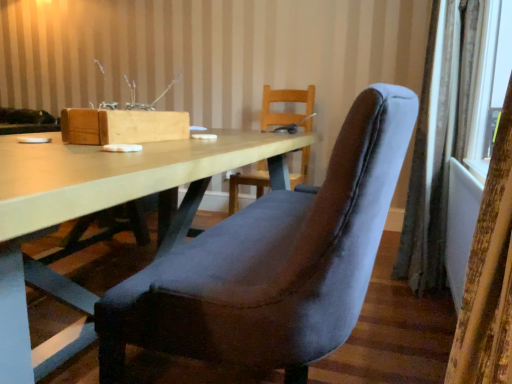
I want to click on matte wood table at center, so tap(103, 205).

Where is `velvet curtain at right, which is the second curtain in back-to-front order`? The width and height of the screenshot is (512, 384). velvet curtain at right, which is the second curtain in back-to-front order is located at coordinates (489, 276).

Locate an element on the screen. matte wood table at center is located at coordinates (103, 205).

Is velvet curtain at right, the second curtain positioned from the left, to the left or to the right of velvet blue chair at center in the image?

velvet curtain at right, the second curtain positioned from the left, is positioned on velvet blue chair at center's right side.

From a real-world perspective, is velvet curtain at right, the second curtain positioned from the left, positioned under velvet blue chair at center based on gravity?

Actually, velvet curtain at right, the second curtain positioned from the left, is physically above velvet blue chair at center in the real world.

In the scene shown: Are velvet curtain at right, the first curtain in the back-to-front sequence, and velvet blue chair at center far apart?

That's right, there is a large distance between velvet curtain at right, the first curtain in the back-to-front sequence, and velvet blue chair at center.

Consider the image. Is velvet curtain at right, the first curtain in the back-to-front sequence, looking in the opposite direction of velvet blue chair at center?

No.

Is velvet blue chair at center taller or shorter than velvet curtain at right, the 2th curtain from the front?

In the image, velvet blue chair at center appears to be shorter than velvet curtain at right, the 2th curtain from the front.

Is velvet blue chair at center not inside velvet curtain at right, the second curtain positioned from the left?

Yes, velvet blue chair at center is outside of velvet curtain at right, the second curtain positioned from the left.

Is velvet blue chair at center positioned with its back to velvet curtain at right, the second curtain positioned from the left?

No, velvet blue chair at center is not facing away from velvet curtain at right, the second curtain positioned from the left.

Does velvet blue chair at center touch velvet curtain at right, the 2th curtain from the front?

No, velvet blue chair at center is not beside velvet curtain at right, the 2th curtain from the front.

Does matte wood table at center contain velvet blue chair at center?

No.

From the image's perspective, between matte wood table at center and velvet blue chair at center, who is located below?

matte wood table at center is shown below in the image.

Which object is further away from the camera taking this photo, matte wood table at center or velvet blue chair at center?

velvet blue chair at center is further away from the camera.

Does matte wood table at center appear on the left side of velvet curtain at right, the 2th curtain from the front?

Yes.

How many degrees apart are the facing directions of matte wood table at center and velvet curtain at right, the first curtain in the back-to-front sequence?

The angular difference between matte wood table at center and velvet curtain at right, the first curtain in the back-to-front sequence, is 7.82 degrees.

Does matte wood table at center lie in front of velvet curtain at right, the second curtain positioned from the left?

Yes, matte wood table at center is closer to the viewer.

Can you confirm if matte wood table at center is wider than velvet curtain at right, the second curtain positioned from the left?

Indeed, matte wood table at center has a greater width compared to velvet curtain at right, the second curtain positioned from the left.

In terms of size, does velvet blue chair at center appear bigger or smaller than velvet curtain at right, acting as the first curtain starting from the left?

Considering their sizes, velvet blue chair at center takes up more space than velvet curtain at right, acting as the first curtain starting from the left.

Does velvet blue chair at center have a greater height compared to velvet curtain at right, acting as the first curtain starting from the left?

Yes, velvet blue chair at center is taller than velvet curtain at right, acting as the first curtain starting from the left.

Can you see velvet blue chair at center touching velvet curtain at right, acting as the first curtain starting from the left?

No, velvet blue chair at center is not next to velvet curtain at right, acting as the first curtain starting from the left.

You are a GUI agent. You are given a task and a screenshot of the screen. Output one action in this format:
    pyautogui.click(x=<x>, y=<y>)
    Task: Click on the 1st curtain to the right of the velvet blue chair at center, starting your count from the anchor
    Image resolution: width=512 pixels, height=384 pixels.
    Given the screenshot: What is the action you would take?
    pyautogui.click(x=489, y=276)

From the image's perspective, is velvet curtain at right, the first curtain in the back-to-front sequence, beneath velvet curtain at right, acting as the first curtain starting from the front?

No.

Based on the photo, from a real-world perspective, is velvet curtain at right, the first curtain positioned from the right, positioned over velvet curtain at right, which is the second curtain in back-to-front order, based on gravity?

Yes, from a real-world perspective, velvet curtain at right, the first curtain positioned from the right, is on top of velvet curtain at right, which is the second curtain in back-to-front order.

Does point (420, 131) appear closer or farther from the camera than point (472, 351)?

Point (420, 131) appears to be farther away from the viewer than point (472, 351).

From the image's perspective, does matte wood table at center appear higher than velvet curtain at right, acting as the first curtain starting from the left?

Incorrect, from the image's perspective, matte wood table at center is lower than velvet curtain at right, acting as the first curtain starting from the left.

Is matte wood table at center positioned with its back to velvet curtain at right, arranged as the 2th curtain when viewed from the right?

Yes, matte wood table at center is positioned with its back facing velvet curtain at right, arranged as the 2th curtain when viewed from the right.

From a real-world perspective, is matte wood table at center physically above velvet curtain at right, which is the second curtain in back-to-front order?

No.

Does point (7, 206) lie in front of point (511, 185)?

That is True.

You are a GUI agent. You are given a task and a screenshot of the screen. Output one action in this format:
    pyautogui.click(x=<x>, y=<y>)
    Task: Click on the chair lying in front of the velvet curtain at right, the 2th curtain from the front
    The width and height of the screenshot is (512, 384).
    Given the screenshot: What is the action you would take?
    pyautogui.click(x=272, y=262)

From the image's perspective, count 2nd curtains upward from the velvet blue chair at center and point to it. Please provide its 2D coordinates.

[(431, 156)]

Considering their positions, is velvet curtain at right, the first curtain in the back-to-front sequence, positioned further to matte wood table at center than velvet curtain at right, arranged as the 2th curtain when viewed from the right?

velvet curtain at right, the first curtain in the back-to-front sequence, lies further to matte wood table at center than the other object.

Considering their positions, is velvet blue chair at center positioned further to velvet curtain at right, arranged as the 2th curtain when viewed from the right, than velvet curtain at right, the first curtain positioned from the right?

A: velvet curtain at right, the first curtain positioned from the right, lies further to velvet curtain at right, arranged as the 2th curtain when viewed from the right, than the other object.

Based on their spatial positions, is velvet curtain at right, the 2th curtain from the front, or velvet blue chair at center further from velvet curtain at right, acting as the first curtain starting from the left?

Among the two, velvet curtain at right, the 2th curtain from the front, is located further to velvet curtain at right, acting as the first curtain starting from the left.

Estimate the real-world distances between objects in this image. Which object is closer to velvet curtain at right, the first curtain in the back-to-front sequence, velvet blue chair at center or velvet curtain at right, acting as the first curtain starting from the front?

velvet blue chair at center.

From the image, which object appears to be nearer to matte wood table at center, velvet curtain at right, which is the second curtain in back-to-front order, or velvet curtain at right, the second curtain positioned from the left?

velvet curtain at right, which is the second curtain in back-to-front order, is closer to matte wood table at center.

Based on their spatial positions, is matte wood table at center or velvet curtain at right, the 2th curtain from the front, closer to velvet curtain at right, which is the second curtain in back-to-front order?

matte wood table at center is closer to velvet curtain at right, which is the second curtain in back-to-front order.

Based on their spatial positions, is matte wood table at center or velvet curtain at right, acting as the first curtain starting from the left, closer to velvet blue chair at center?

Among the two, matte wood table at center is located nearer to velvet blue chair at center.

When comparing their distances from velvet curtain at right, the first curtain positioned from the right, does matte wood table at center or velvet blue chair at center seem closer?

Among the two, matte wood table at center is located nearer to velvet curtain at right, the first curtain positioned from the right.

Locate an element on the screen. chair located between matte wood table at center and velvet curtain at right, which is the second curtain in back-to-front order, in the left-right direction is located at coordinates (272, 262).

Where is `table between velvet curtain at right, arranged as the 2th curtain when viewed from the right, and velvet curtain at right, the first curtain in the back-to-front sequence, from front to back`? table between velvet curtain at right, arranged as the 2th curtain when viewed from the right, and velvet curtain at right, the first curtain in the back-to-front sequence, from front to back is located at coordinates (103, 205).

Identify the location of chair between velvet curtain at right, which is the second curtain in back-to-front order, and velvet curtain at right, the second curtain positioned from the left, from front to back. This screenshot has height=384, width=512. (272, 262).

Where is `chair between matte wood table at center and velvet curtain at right, the first curtain in the back-to-front sequence`? This screenshot has height=384, width=512. chair between matte wood table at center and velvet curtain at right, the first curtain in the back-to-front sequence is located at coordinates (272, 262).